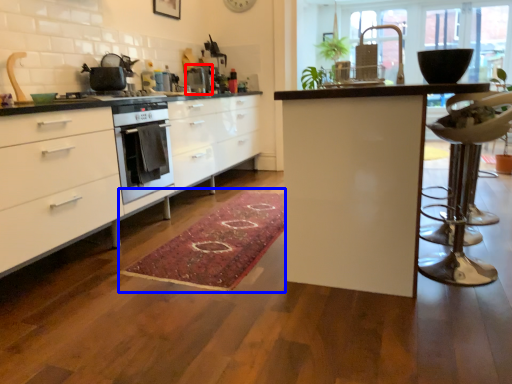
Question: Which point is closer to the camera, appliance (highlighted by a red box) or doormat (highlighted by a blue box)?

Choices:
 (A) appliance
 (B) doormat

Answer: (B)